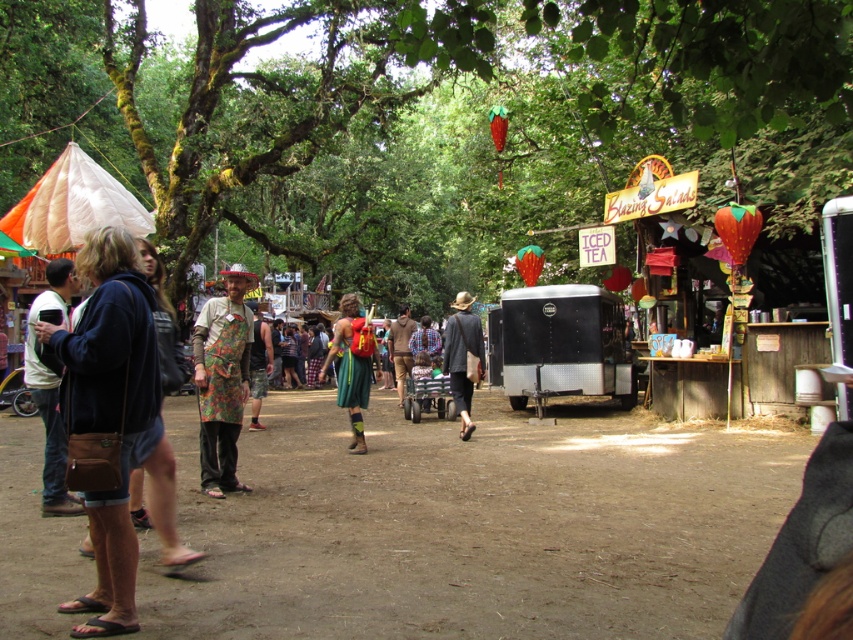
You are a festival attendee holding a map and trying to locate the main stage. You see the green leafy tree at center and the matte brown hat at center. Which object is closer to your eye level?

The matte brown hat at center is closer to your eye level because the green leafy tree at center is larger in size, implying it is farther away.

You are planning to set up a temporary tent for a small event between the green leafy tree at center and the black metal trailer at center. Considering their sizes, which object will require more space around it to avoid obstruction?

The green leafy tree at center has a larger size compared to the black metal trailer at center, so it will require more space around it to avoid obstruction.

You are at a festival and want to set up a new booth between the green leafy tree at center and the black metal trailer at center. The minimum space required for the booth is 8 meters. Is there enough space between them to place the booth?

The green leafy tree at center is 9.63 meters away from the black metal trailer at center, so yes, there is enough space to place the booth between them since the distance is greater than the required 8 meters.